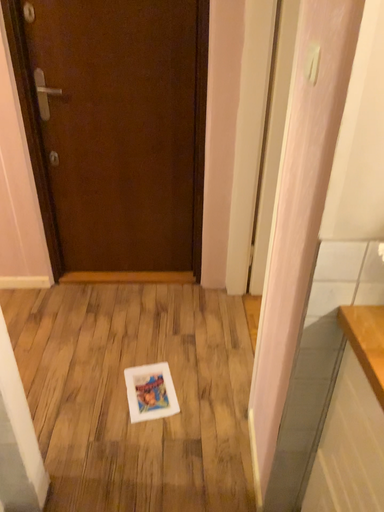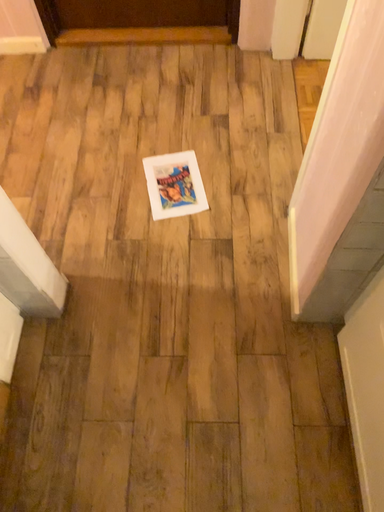
Question: Which way did the camera rotate in the video?

Choices:
 (A) rotated downward
 (B) rotated upward

Answer: (A)